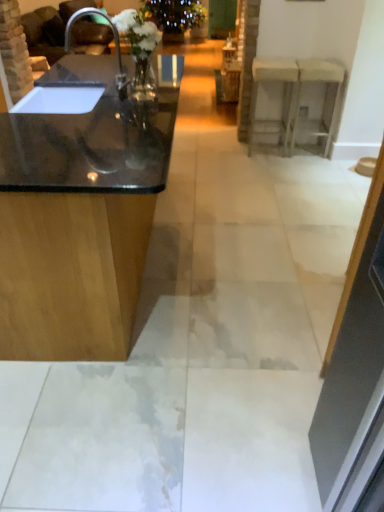
Question: Can you confirm if white glossy counter at upper right, the 2th counter when ordered from front to back, is smaller than transparent glass door at upper center?

Choices:
 (A) yes
 (B) no

Answer: (A)

Question: From a real-world perspective, is white glossy counter at upper right, which is the 2th counter from left to right, positioned under transparent glass door at upper center based on gravity?

Choices:
 (A) no
 (B) yes

Answer: (A)

Question: Is white glossy counter at upper right, the 1th counter viewed from the right, not inside transparent glass door at upper center?

Choices:
 (A) yes
 (B) no

Answer: (A)

Question: Does white glossy counter at upper right, the 1th counter in the back-to-front sequence, touch transparent glass door at upper center?

Choices:
 (A) no
 (B) yes

Answer: (A)

Question: Considering the relative positions of white glossy counter at upper right, the 1th counter in the back-to-front sequence, and transparent glass door at upper center in the image provided, is white glossy counter at upper right, the 1th counter in the back-to-front sequence, to the left of transparent glass door at upper center from the viewer's perspective?

Choices:
 (A) yes
 (B) no

Answer: (B)

Question: Considering the positions of transparent glass door at upper center and black glossy countertop at left, arranged as the 1th counter when viewed from the left, in the image, is transparent glass door at upper center wider or thinner than black glossy countertop at left, arranged as the 1th counter when viewed from the left,?

Choices:
 (A) wide
 (B) thin

Answer: (B)

Question: From the image's perspective, relative to black glossy countertop at left, the first counter viewed from the front, is transparent glass door at upper center above or below?

Choices:
 (A) below
 (B) above

Answer: (B)

Question: From a real-world perspective, is transparent glass door at upper center positioned above or below black glossy countertop at left, the 2th counter viewed from the back?

Choices:
 (A) below
 (B) above

Answer: (A)

Question: In terms of height, does transparent glass door at upper center look taller or shorter compared to black glossy countertop at left, the 2th counter viewed from the back?

Choices:
 (A) tall
 (B) short

Answer: (B)

Question: Based on their sizes in the image, would you say matte black sink at left is bigger or smaller than transparent glass door at upper center?

Choices:
 (A) big
 (B) small

Answer: (B)

Question: From the image's perspective, is matte black sink at left above or below transparent glass door at upper center?

Choices:
 (A) below
 (B) above

Answer: (A)

Question: In terms of width, does matte black sink at left look wider or thinner when compared to transparent glass door at upper center?

Choices:
 (A) thin
 (B) wide

Answer: (B)

Question: Considering the positions of point (1, 32) and point (208, 35), is point (1, 32) closer or farther from the camera than point (208, 35)?

Choices:
 (A) closer
 (B) farther

Answer: (A)

Question: Which is correct: white glossy counter at upper right, the 2th counter when ordered from front to back, is inside black glossy countertop at left, arranged as the 1th counter when viewed from the left, or outside of it?

Choices:
 (A) inside
 (B) outside

Answer: (B)

Question: Is white glossy counter at upper right, the 1th counter in the back-to-front sequence, bigger or smaller than black glossy countertop at left, the first counter viewed from the front?

Choices:
 (A) small
 (B) big

Answer: (A)